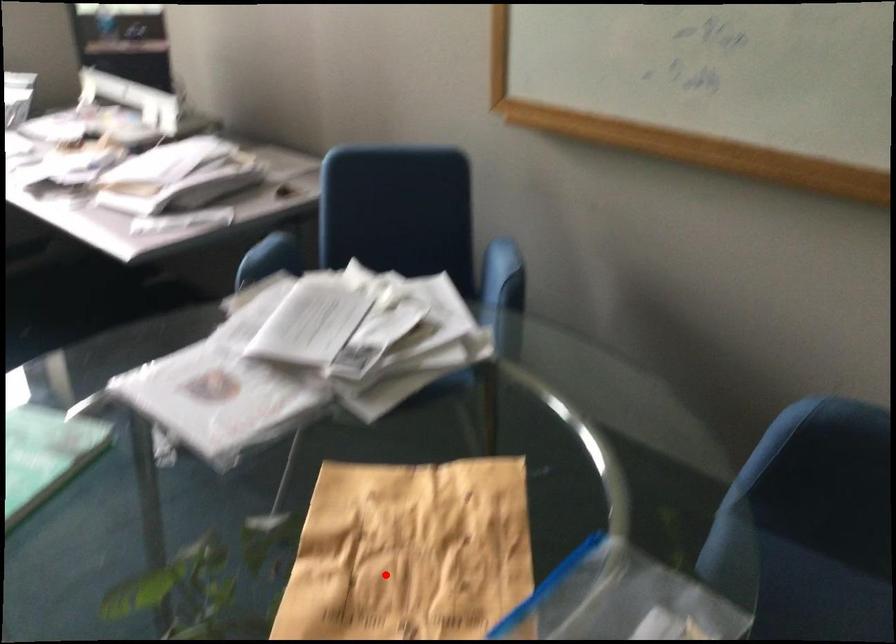
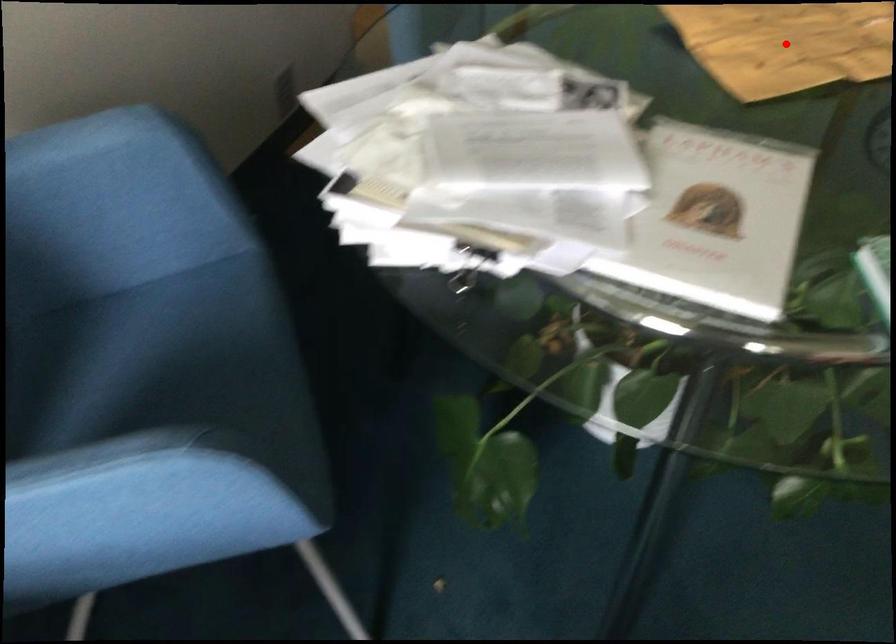
I am providing you with two images of the same scene from different viewpoints. A red point is marked on the first image and another point is marked on the second image. Is the red point in image1 aligned with the point shown in image2?

Yes